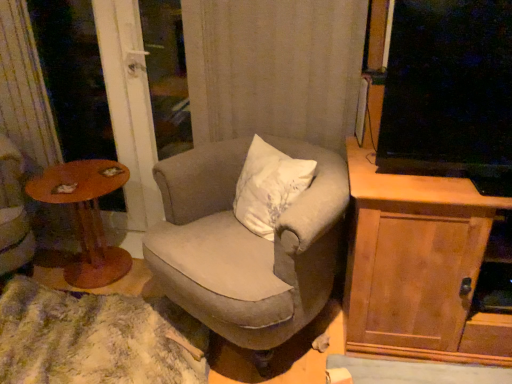
The height and width of the screenshot is (384, 512). What do you see at coordinates (419, 267) in the screenshot? I see `wooden cabinet at right` at bounding box center [419, 267].

Describe the element at coordinates (115, 88) in the screenshot. This screenshot has height=384, width=512. I see `transparent glass screen door at left` at that location.

The width and height of the screenshot is (512, 384). What do you see at coordinates (86, 216) in the screenshot?
I see `wooden round table at left` at bounding box center [86, 216].

In order to click on wooden round table at left in this screenshot , I will do `click(86, 216)`.

Find the location of a particular element. The width and height of the screenshot is (512, 384). wooden cabinet at right is located at coordinates (419, 267).

Which is in front, transparent glass screen door at left or fuzzy carpet at lower left?

Positioned in front is fuzzy carpet at lower left.

Looking at their sizes, would you say transparent glass screen door at left is wider or thinner than fuzzy carpet at lower left?

transparent glass screen door at left is thinner than fuzzy carpet at lower left.

From the image's perspective, is transparent glass screen door at left positioned above or below fuzzy carpet at lower left?

transparent glass screen door at left is above fuzzy carpet at lower left.

Is point (98, 39) more distant than point (33, 327)?

Yes, it is behind point (33, 327).

Can you tell me how much wooden cabinet at right and transparent glass screen door at left differ in facing direction?

The facing directions of wooden cabinet at right and transparent glass screen door at left are 89.3 degrees apart.

Is wooden cabinet at right oriented towards transparent glass screen door at left?

Yes, wooden cabinet at right is facing transparent glass screen door at left.

Which is nearer, (453, 238) or (126, 201)?

Point (453, 238) is closer to the camera than point (126, 201).

Is wooden round table at left thinner than fuzzy carpet at lower left?

Yes.

From a real-world perspective, which is physically above, wooden round table at left or fuzzy carpet at lower left?

wooden round table at left, from a real-world perspective.

From the picture: Which is closer, (128, 253) or (103, 336)?

Point (128, 253) is positioned farther from the camera compared to point (103, 336).

The image size is (512, 384). In order to click on table above the fuzzy carpet at lower left (from the image's perspective) in this screenshot , I will do `click(86, 216)`.

Are fuzzy carpet at lower left and wooden round table at left beside each other?

No, fuzzy carpet at lower left is not next to wooden round table at left.

Does point (131, 366) appear closer or farther from the camera than point (96, 273)?

Point (131, 366) is closer to the camera than point (96, 273).

Considering the sizes of objects textured beige armchair at center and wooden cabinet at right in the image provided, who is taller, textured beige armchair at center or wooden cabinet at right?

wooden cabinet at right is taller.

Are textured beige armchair at center and wooden cabinet at right far apart?

That's not correct — textured beige armchair at center is a little close to wooden cabinet at right.

From the image's perspective, between textured beige armchair at center and wooden cabinet at right, who is located below?

wooden cabinet at right.

Is textured beige armchair at center placed right next to transparent glass screen door at left?

They are not placed beside each other.

Is point (192, 218) more distant than point (76, 123)?

No, (192, 218) is in front of (76, 123).

Is textured beige armchair at center wider or thinner than transparent glass screen door at left?

Considering their sizes, textured beige armchair at center looks broader than transparent glass screen door at left.

Identify the location of chair that appears in front of the transparent glass screen door at left. This screenshot has width=512, height=384. (246, 244).

From a real-world perspective, is wooden cabinet at right physically located above or below wooden round table at left?

wooden cabinet at right is above wooden round table at left.

From the image's perspective, is wooden cabinet at right on wooden round table at left?

No, from the image's perspective, wooden cabinet at right is not above wooden round table at left.

Is wooden cabinet at right oriented away from wooden round table at left?

No, wooden round table at left is not at the back of wooden cabinet at right.

I want to click on table above the wooden cabinet at right (from the image's perspective), so click(x=86, y=216).

Identify the location of screen door above the fuzzy carpet at lower left (from the image's perspective). (115, 88).

The image size is (512, 384). Find the location of `cabinetry below the transparent glass screen door at left (from the image's perspective)`. cabinetry below the transparent glass screen door at left (from the image's perspective) is located at coordinates (419, 267).

When comparing their distances from transparent glass screen door at left, does wooden round table at left or textured beige armchair at center seem further?

textured beige armchair at center.

Considering their positions, is fuzzy carpet at lower left positioned further to transparent glass screen door at left than wooden round table at left?

Based on the image, fuzzy carpet at lower left appears to be further to transparent glass screen door at left.

Considering their positions, is wooden round table at left positioned closer to transparent glass screen door at left than wooden cabinet at right?

Among the two, wooden round table at left is located nearer to transparent glass screen door at left.

Which object lies nearer to the anchor point textured beige armchair at center, wooden cabinet at right or transparent glass screen door at left?

Based on the image, wooden cabinet at right appears to be nearer to textured beige armchair at center.

When comparing their distances from transparent glass screen door at left, does fuzzy carpet at lower left or wooden cabinet at right seem further?

wooden cabinet at right lies further to transparent glass screen door at left than the other object.

In the scene shown: Considering their positions, is textured beige armchair at center positioned further to wooden cabinet at right than wooden round table at left?

wooden round table at left.

Based on their spatial positions, is transparent glass screen door at left or fuzzy carpet at lower left further from textured beige armchair at center?

Based on the image, transparent glass screen door at left appears to be further to textured beige armchair at center.

Estimate the real-world distances between objects in this image. Which object is closer to fuzzy carpet at lower left, transparent glass screen door at left or wooden round table at left?

wooden round table at left lies closer to fuzzy carpet at lower left than the other object.

Image resolution: width=512 pixels, height=384 pixels. Identify the location of table between transparent glass screen door at left and textured beige armchair at center from left to right. (86, 216).

Locate an element on the screen. The image size is (512, 384). chair between transparent glass screen door at left and fuzzy carpet at lower left in the up-down direction is located at coordinates (246, 244).

You are a GUI agent. You are given a task and a screenshot of the screen. Output one action in this format:
    pyautogui.click(x=<x>, y=<y>)
    Task: Click on the chair between wooden round table at left and wooden cabinet at right
    The width and height of the screenshot is (512, 384).
    Given the screenshot: What is the action you would take?
    pyautogui.click(x=246, y=244)

Locate an element on the screen. Image resolution: width=512 pixels, height=384 pixels. plain between wooden round table at left and wooden cabinet at right from left to right is located at coordinates (96, 339).